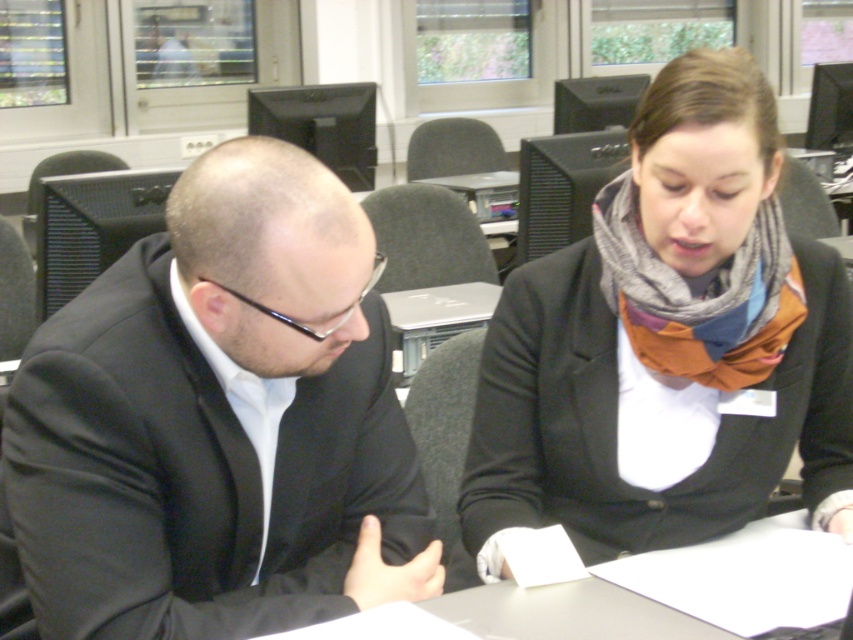
Is black matte suit at left above knitted scarf at center?

No, black matte suit at left is not above knitted scarf at center.

In the scene shown: Is black matte suit at left positioned behind knitted scarf at center?

No, black matte suit at left is in front of knitted scarf at center.

Who is more distant from viewer, (424, 496) or (850, 326)?

The point (850, 326) is more distant.

The image size is (853, 640). In order to click on black matte suit at left in this screenshot , I will do `click(219, 422)`.